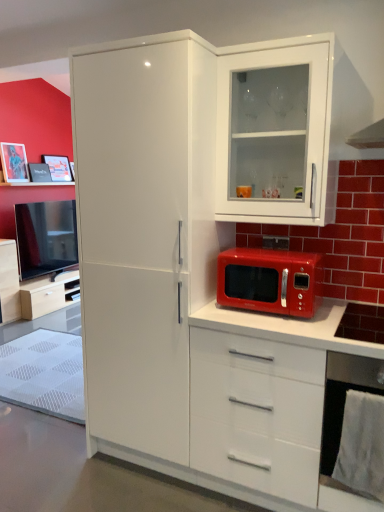
In order to face brushed metal picture frame at upper left, which is the first picture frame in front-to-back order, should I rotate leftwards or rightwards?

To align with it, rotate left about 22.596°.

Where is `brushed metal picture frame at upper left, which is the first picture frame in front-to-back order`? brushed metal picture frame at upper left, which is the first picture frame in front-to-back order is located at coordinates point(14,163).

Measure the distance between matte white cabinet at left, marked as the 2th cabinetry in a front-to-back arrangement, and camera.

They are 14.80 feet apart.

Find the location of a particular element. The image size is (384, 512). metallic silver oven at lower right is located at coordinates (343, 406).

Describe the element at coordinates (58, 167) in the screenshot. This screenshot has width=384, height=512. I see `matte black picture frame at upper left, which ranks as the second picture frame in left-to-right order` at that location.

Locate an element on the screen. The image size is (384, 512). brushed metal picture frame at upper left, the 2th picture frame when ordered from right to left is located at coordinates (14, 163).

From the image's perspective, is shiny red microwave at center below matte black phone at center?

Correct, shiny red microwave at center appears lower than matte black phone at center in the image.

Can you confirm if shiny red microwave at center is taller than matte black phone at center?

Yes, shiny red microwave at center is taller than matte black phone at center.

Is shiny red microwave at center completely or partially outside of matte black phone at center?

shiny red microwave at center lies outside matte black phone at center's area.

How different are the orientations of shiny red microwave at center and matte black phone at center in degrees?

They differ by 0.00505 degrees in their facing directions.

From the image's perspective, which is above, white glossy cabinet at upper right, the second cabinetry when ordered from back to front, or brushed metal picture frame at upper left, the 2th picture frame when ordered from right to left?

brushed metal picture frame at upper left, the 2th picture frame when ordered from right to left, is shown above in the image.

Which is in front, white glossy cabinet at upper right, which ranks as the 1th cabinetry in top-to-bottom order, or brushed metal picture frame at upper left, the 2th picture frame when ordered from right to left?

white glossy cabinet at upper right, which ranks as the 1th cabinetry in top-to-bottom order.

Where is `cabinetry on the right of brushed metal picture frame at upper left, which is the second picture frame from back to front`? cabinetry on the right of brushed metal picture frame at upper left, which is the second picture frame from back to front is located at coordinates click(x=274, y=133).

From a real-world perspective, is white glossy cabinet at upper right, arranged as the first cabinetry when viewed from the front, physically located above or below brushed metal picture frame at upper left, the 2th picture frame when ordered from right to left?

white glossy cabinet at upper right, arranged as the first cabinetry when viewed from the front, is situated higher than brushed metal picture frame at upper left, the 2th picture frame when ordered from right to left, in the real world.

How many degrees apart are the facing directions of white glossy cabinet at upper right, arranged as the first cabinetry when viewed from the front, and matte white cabinet at left, marked as the 1th cabinetry in a bottom-to-top arrangement?

There is a 90-degree angle between the facing directions of white glossy cabinet at upper right, arranged as the first cabinetry when viewed from the front, and matte white cabinet at left, marked as the 1th cabinetry in a bottom-to-top arrangement.

From the image's perspective, between white glossy cabinet at upper right, arranged as the 2th cabinetry when viewed from the left, and matte white cabinet at left, marked as the 2th cabinetry in a front-to-back arrangement, who is located below?

matte white cabinet at left, marked as the 2th cabinetry in a front-to-back arrangement, appears lower in the image.

How distant is white glossy cabinet at upper right, arranged as the 2th cabinetry when viewed from the left, from matte white cabinet at left, the 1th cabinetry positioned from the left?

white glossy cabinet at upper right, arranged as the 2th cabinetry when viewed from the left, is 3.44 meters from matte white cabinet at left, the 1th cabinetry positioned from the left.

Is point (280, 67) positioned before point (5, 284)?

Yes, it is in front of point (5, 284).

From the picture: Between white glossy cabinet at upper right, which ranks as the 1th cabinetry in top-to-bottom order, and matte black picture frame at upper left, placed as the second picture frame when sorted from front to back, which one appears on the left side from the viewer's perspective?

Positioned to the left is matte black picture frame at upper left, placed as the second picture frame when sorted from front to back.

From the image's perspective, relative to matte black picture frame at upper left, which ranks as the second picture frame in left-to-right order, is white glossy cabinet at upper right, arranged as the first cabinetry when viewed from the front, above or below?

white glossy cabinet at upper right, arranged as the first cabinetry when viewed from the front, is below matte black picture frame at upper left, which ranks as the second picture frame in left-to-right order.

Which is behind, white glossy cabinet at upper right, the second cabinetry when ordered from back to front, or matte black picture frame at upper left, which ranks as the second picture frame in left-to-right order?

matte black picture frame at upper left, which ranks as the second picture frame in left-to-right order, is more distant.

Is white glossy cabinet at upper right, which ranks as the 1th cabinetry in top-to-bottom order, located outside matte black picture frame at upper left, which ranks as the second picture frame in left-to-right order?

Yes, white glossy cabinet at upper right, which ranks as the 1th cabinetry in top-to-bottom order, is located beyond the bounds of matte black picture frame at upper left, which ranks as the second picture frame in left-to-right order.

Would you say white glossy cabinet at upper right, which is the 1th cabinetry from right to left, is part of white glossy refrigerator at center's contents?

Actually, white glossy cabinet at upper right, which is the 1th cabinetry from right to left, is outside white glossy refrigerator at center.

Is white glossy refrigerator at center facing away from white glossy cabinet at upper right, arranged as the 2th cabinetry when ordered from the bottom?

No.

Locate an element on the screen. refrigerator to the left of white glossy cabinet at upper right, the second cabinetry when ordered from back to front is located at coordinates [143, 231].

Which is in front, point (113, 298) or point (218, 108)?

The point (218, 108) is more forward.

Based on the photo, considering the relative sizes of white glossy cabinet at upper right, the second cabinetry when ordered from back to front, and matte black phone at center in the image provided, is white glossy cabinet at upper right, the second cabinetry when ordered from back to front, bigger than matte black phone at center?

Yes, white glossy cabinet at upper right, the second cabinetry when ordered from back to front, is bigger than matte black phone at center.

Where is `cabinetry in front of the matte black phone at center`? This screenshot has height=512, width=384. cabinetry in front of the matte black phone at center is located at coordinates (274, 133).

Is white glossy cabinet at upper right, arranged as the first cabinetry when viewed from the front, far away from matte black phone at center?

That's not correct — white glossy cabinet at upper right, arranged as the first cabinetry when viewed from the front, is a little close to matte black phone at center.

Is white glossy cabinet at upper right, arranged as the first cabinetry when viewed from the front, taller or shorter than matte black phone at center?

Considering their sizes, white glossy cabinet at upper right, arranged as the first cabinetry when viewed from the front, has more height than matte black phone at center.

From a real-world perspective, is brushed metal picture frame at upper left, which is the second picture frame from back to front, physically located above or below metallic silver oven at lower right?

Clearly, from a real-world perspective, brushed metal picture frame at upper left, which is the second picture frame from back to front, is above metallic silver oven at lower right.

Choose the correct answer: Is brushed metal picture frame at upper left, the 2th picture frame when ordered from right to left, inside metallic silver oven at lower right or outside it?

brushed metal picture frame at upper left, the 2th picture frame when ordered from right to left, is spatially situated outside metallic silver oven at lower right.

Does brushed metal picture frame at upper left, which is counted as the first picture frame, starting from the left, have a greater height compared to metallic silver oven at lower right?

Incorrect, the height of brushed metal picture frame at upper left, which is counted as the first picture frame, starting from the left, is not larger of that of metallic silver oven at lower right.

Identify the location of microwave oven that appears below the matte black phone at center (from the image's perspective). The width and height of the screenshot is (384, 512). (270, 281).

You are a GUI agent. You are given a task and a screenshot of the screen. Output one action in this format:
    pyautogui.click(x=<x>, y=<y>)
    Task: Click on the 2nd picture frame counting from the left of the white glossy cabinet at upper right, arranged as the 2th cabinetry when viewed from the left
    
    Given the screenshot: What is the action you would take?
    pyautogui.click(x=14, y=163)

Based on their spatial positions, is shiny red microwave at center or brushed metal picture frame at upper left, which is the second picture frame from back to front, closer to white glossy refrigerator at center?

shiny red microwave at center lies closer to white glossy refrigerator at center than the other object.

Based on their spatial positions, is brushed metal picture frame at upper left, which is the second picture frame from back to front, or metallic silver oven at lower right further from white glossy refrigerator at center?

Based on the image, brushed metal picture frame at upper left, which is the second picture frame from back to front, appears to be further to white glossy refrigerator at center.

Considering their positions, is brushed metal picture frame at upper left, which is the second picture frame from back to front, positioned closer to metallic silver oven at lower right than white glossy cabinet at upper right, arranged as the 2th cabinetry when viewed from the left?

white glossy cabinet at upper right, arranged as the 2th cabinetry when viewed from the left, lies closer to metallic silver oven at lower right than the other object.

Estimate the real-world distances between objects in this image. Which object is closer to white glossy refrigerator at center, shiny red microwave at center or matte black phone at center?

The object closer to white glossy refrigerator at center is shiny red microwave at center.

Looking at the image, which one is located closer to shiny red microwave at center, matte black phone at center or brushed metal picture frame at upper left, the 2th picture frame when ordered from right to left?

matte black phone at center.

From the picture: Which object lies further to the anchor point white glossy cabinet at upper right, which ranks as the 1th cabinetry in top-to-bottom order, white glossy refrigerator at center or matte black phone at center?

The object further to white glossy cabinet at upper right, which ranks as the 1th cabinetry in top-to-bottom order, is matte black phone at center.

Considering their positions, is white glossy refrigerator at center positioned further to matte white cabinet at left, which is counted as the 2th cabinetry, starting from the right, than matte black picture frame at upper left, placed as the 1th picture frame when sorted from right to left?

white glossy refrigerator at center is positioned further to the anchor matte white cabinet at left, which is counted as the 2th cabinetry, starting from the right.

Considering their positions, is white glossy cabinet at upper right, arranged as the 2th cabinetry when ordered from the bottom, positioned closer to matte white cabinet at left, acting as the second cabinetry starting from the top, than white glossy refrigerator at center?

white glossy refrigerator at center is closer to matte white cabinet at left, acting as the second cabinetry starting from the top.

Image resolution: width=384 pixels, height=512 pixels. What are the coordinates of `microwave oven located between matte white cabinet at left, which is counted as the 2th cabinetry, starting from the right, and matte black phone at center in the left-right direction` in the screenshot? It's located at (270, 281).

I want to click on microwave oven between matte white cabinet at left, acting as the second cabinetry starting from the top, and metallic silver oven at lower right, in the horizontal direction, so click(270, 281).

You are a GUI agent. You are given a task and a screenshot of the screen. Output one action in this format:
    pyautogui.click(x=<x>, y=<y>)
    Task: Click on the microwave oven between matte white cabinet at left, marked as the 1th cabinetry in a bottom-to-top arrangement, and white glossy cabinet at upper right, arranged as the 2th cabinetry when ordered from the bottom
    The height and width of the screenshot is (512, 384).
    Given the screenshot: What is the action you would take?
    pyautogui.click(x=270, y=281)

I want to click on microwave oven positioned between white glossy cabinet at upper right, arranged as the 2th cabinetry when viewed from the left, and brushed metal picture frame at upper left, which is the second picture frame from back to front, from near to far, so click(270, 281).